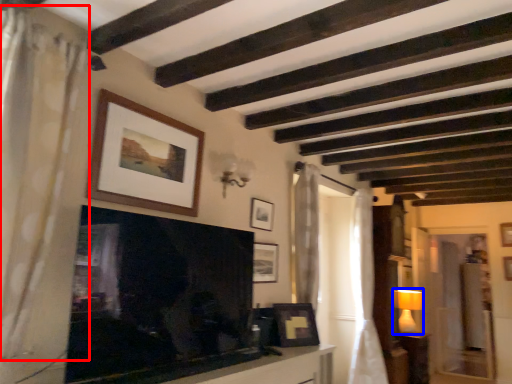
Question: Which point is closer to the camera, curtain (highlighted by a red box) or lamp (highlighted by a blue box)?

Choices:
 (A) curtain
 (B) lamp

Answer: (A)